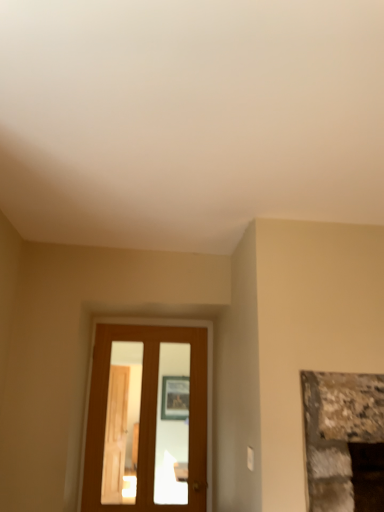
What is the approximate width of clear glass door at center?

The width of clear glass door at center is 4.94 inches.

You are a GUI agent. You are given a task and a screenshot of the screen. Output one action in this format:
    pyautogui.click(x=<x>, y=<y>)
    Task: Click on the clear glass door at center
    The width and height of the screenshot is (384, 512).
    Given the screenshot: What is the action you would take?
    pyautogui.click(x=143, y=392)

What do you see at coordinates (143, 392) in the screenshot?
I see `clear glass door at center` at bounding box center [143, 392].

Find the location of a particular element. clear glass door at center is located at coordinates (143, 392).